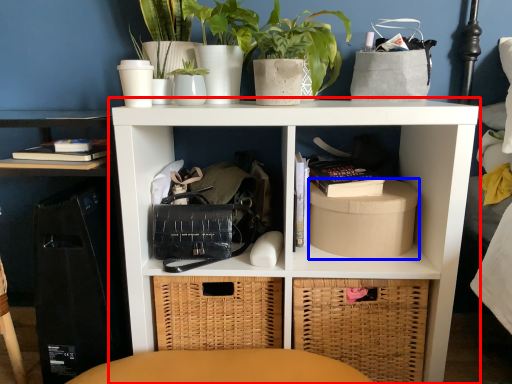
Question: Among these objects, which one is nearest to the camera, shelf (highlighted by a red box) or cardboard box (highlighted by a blue box)?

Choices:
 (A) shelf
 (B) cardboard box

Answer: (A)